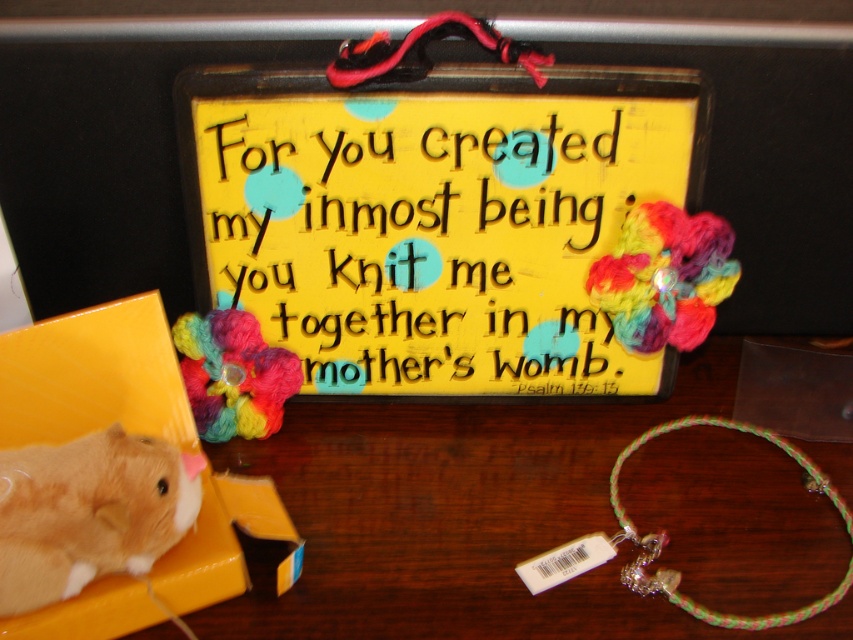
You are standing in front of the plaque and notice two points marked in the scene. Which point is closer to you? The points are labeled as point (656, 292) and point (202, 340).

Point (656, 292) is in front of point (202, 340), so it is closer to you.